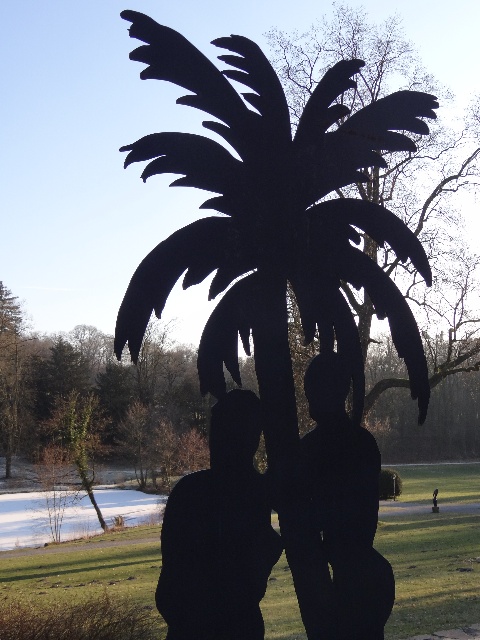
Question: Which object appears closest to the camera in this image?

Choices:
 (A) black matte man at center
 (B) black matte statue at center

Answer: (B)

Question: Can you confirm if black matte palm tree at center is positioned below black matte couple at center?

Choices:
 (A) no
 (B) yes

Answer: (A)

Question: Can you confirm if black matte couple at center is positioned to the left of black matte man at center?

Choices:
 (A) yes
 (B) no

Answer: (A)

Question: Does black matte palm tree at center appear on the right side of black matte couple at center?

Choices:
 (A) no
 (B) yes

Answer: (A)

Question: Which object is closer to the camera taking this photo?

Choices:
 (A) black matte man at center
 (B) black matte statue at center
 (C) black matte couple at center
 (D) black matte palm tree at center

Answer: (D)

Question: Which of these objects is positioned farthest from the black matte man at center?

Choices:
 (A) black matte couple at center
 (B) black matte statue at center
 (C) black matte palm tree at center

Answer: (C)